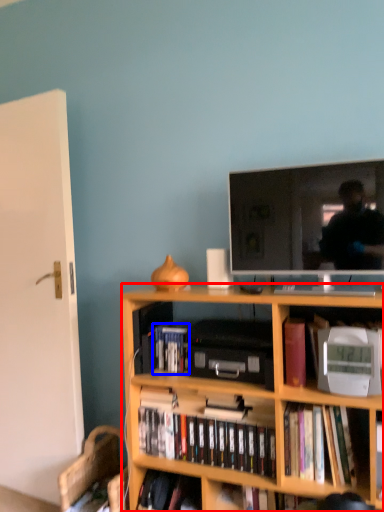
Question: Which object is closer to the camera taking this photo, bookcase (highlighted by a red box) or book (highlighted by a blue box)?

Choices:
 (A) bookcase
 (B) book

Answer: (A)